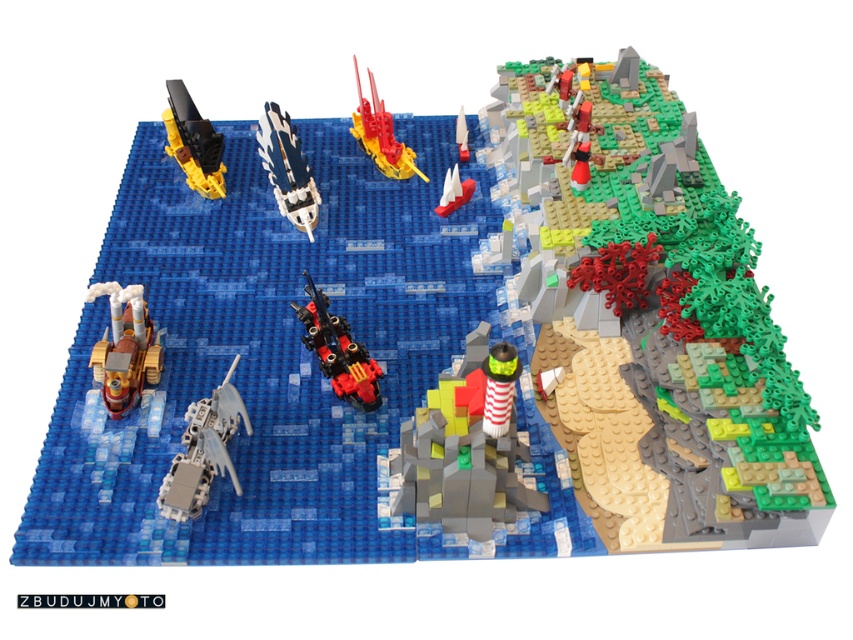
Question: In this image, where is metallic silver spaceship at center-left located relative to shiny yellow plastic submarine at upper left?

Choices:
 (A) below
 (B) above

Answer: (A)

Question: Which of the following is the farthest from the observer?

Choices:
 (A) red and white striped lighthouse at center
 (B) shiny black and red plastic submarine at center
 (C) gold metallic steamboat at lower left

Answer: (B)

Question: Which object is farther from the camera taking this photo?

Choices:
 (A) white plastic sailboat at center
 (B) red and white striped lighthouse at center
 (C) smooth red boat at center
 (D) smooth green rock at upper right

Answer: (C)

Question: Is red and white striped lighthouse at center behind translucent red plastic ship at upper center?

Choices:
 (A) yes
 (B) no

Answer: (B)

Question: Is shiny black and red plastic submarine at center wider than shiny metallic spaceship at center?

Choices:
 (A) yes
 (B) no

Answer: (A)

Question: Which of the following is the closest to the observer?

Choices:
 (A) shiny metallic spaceship at center
 (B) white plastic sailboat at center
 (C) red and white striped lighthouse at center
 (D) gold metallic steamboat at lower left

Answer: (C)